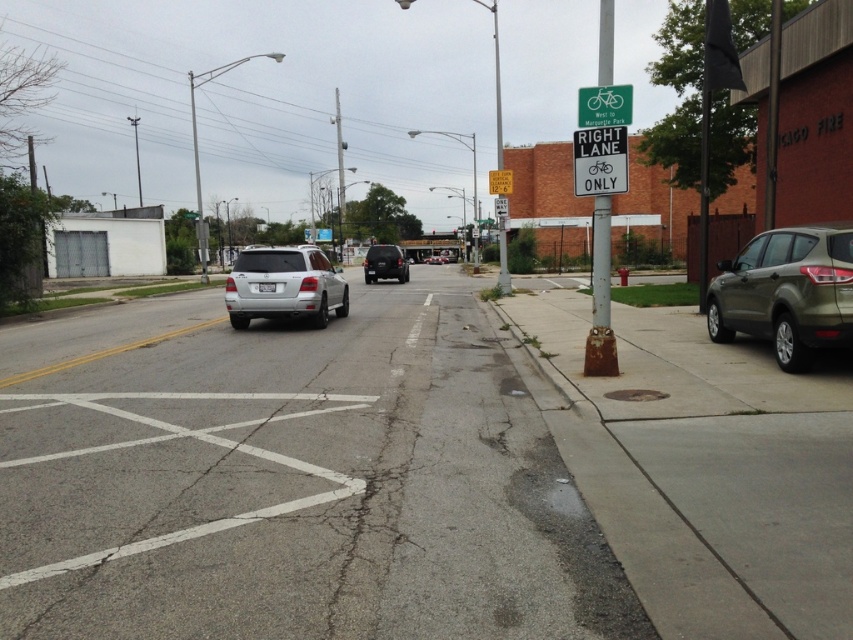
Question: Which point appears closest to the camera in this image?

Choices:
 (A) (503, 177)
 (B) (344, 312)
 (C) (627, 172)
 (D) (370, 259)

Answer: (C)

Question: Does satin silver suv at center come in front of white plastic sign at right lane?

Choices:
 (A) no
 (B) yes

Answer: (A)

Question: Which point appears closest to the camera in this image?

Choices:
 (A) (270, 273)
 (B) (611, 186)

Answer: (B)

Question: Considering the relative positions of shiny black suv at center and yellow paper sign at upper center in the image provided, where is shiny black suv at center located with respect to yellow paper sign at upper center?

Choices:
 (A) below
 (B) above

Answer: (A)

Question: Which object is positioned closest to the matte olive suv at right?

Choices:
 (A) white plastic sign at right lane
 (B) shiny black suv at center
 (C) satin silver suv at center
 (D) yellow paper sign at upper center

Answer: (A)

Question: Is matte olive suv at right further to camera compared to satin silver suv at center?

Choices:
 (A) yes
 (B) no

Answer: (B)